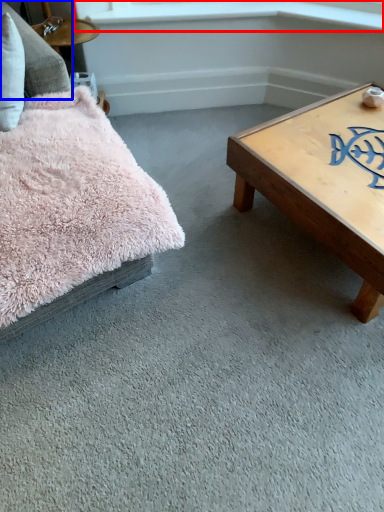
Question: Which object appears closest to the camera in this image, window sill (highlighted by a red box) or pillow (highlighted by a blue box)?

Choices:
 (A) window sill
 (B) pillow

Answer: (B)